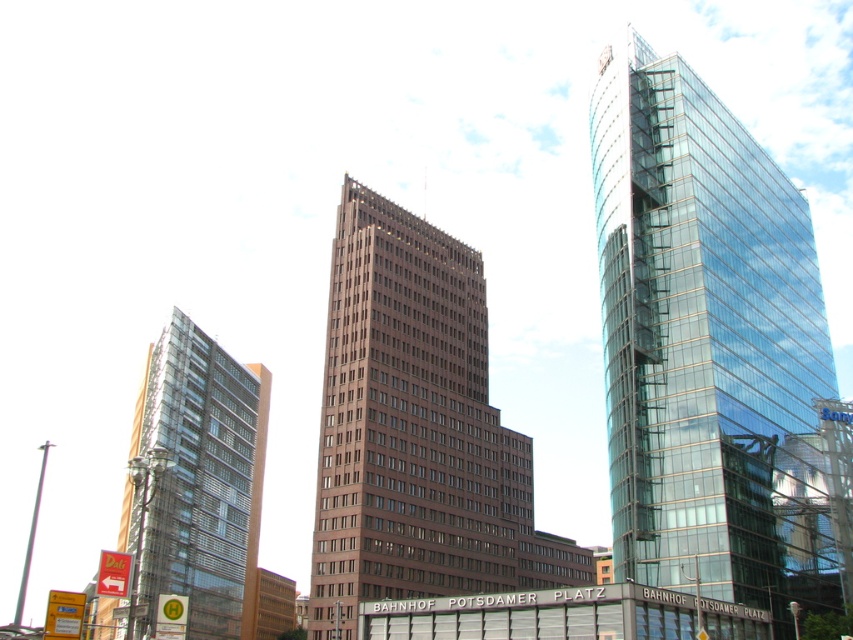
Question: Is transparent glass tower at right to the right of clear glass building at left from the viewer's perspective?

Choices:
 (A) yes
 (B) no

Answer: (A)

Question: Is transparent glass tower at right bigger than clear glass building at left?

Choices:
 (A) no
 (B) yes

Answer: (A)

Question: Which of the following is the farthest from the observer?

Choices:
 (A) (466, 442)
 (B) (746, 173)
 (C) (265, 388)

Answer: (C)

Question: Is brown brick building at center behind clear glass building at left?

Choices:
 (A) yes
 (B) no

Answer: (A)

Question: Which point is farther from the camera taking this photo?

Choices:
 (A) (456, 429)
 (B) (178, 564)

Answer: (B)

Question: Which of the following is the closest to the observer?

Choices:
 (A) brown brick building at center
 (B) clear glass building at left

Answer: (B)